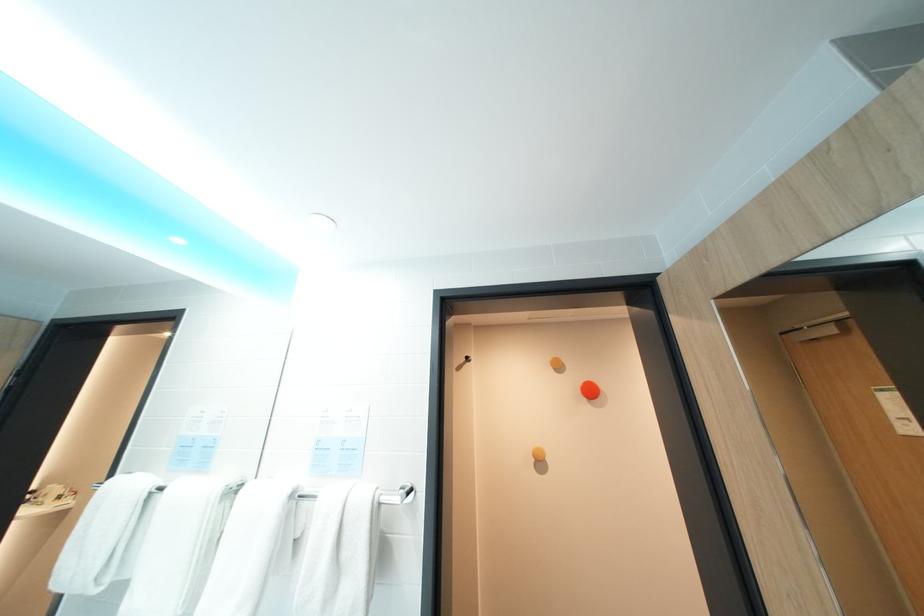
Image resolution: width=924 pixels, height=616 pixels. What do you see at coordinates (463, 363) in the screenshot?
I see `the black door hook` at bounding box center [463, 363].